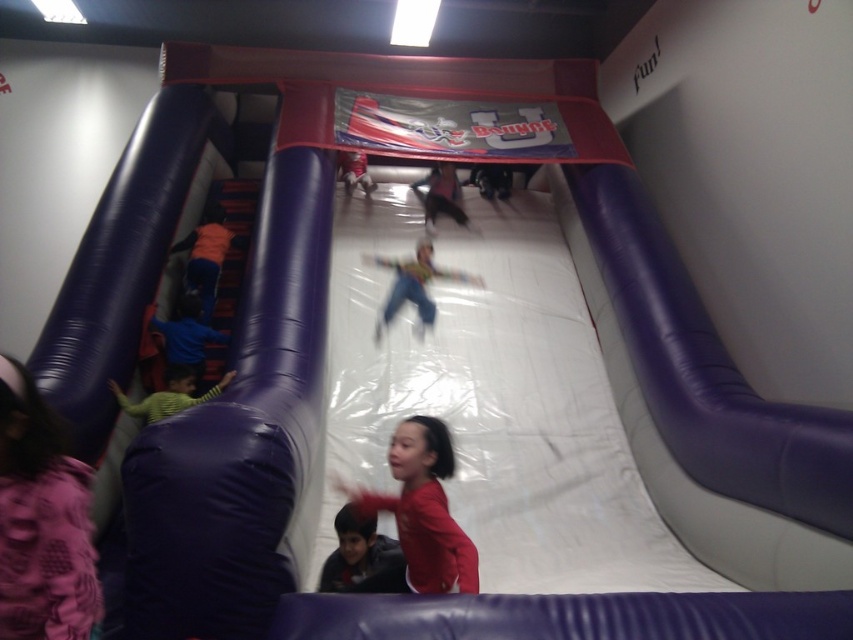
Does matte purple dress at lower left appear on the left side of orange fabric pants at left?

No, matte purple dress at lower left is not to the left of orange fabric pants at left.

Which of these two, matte purple dress at lower left or orange fabric pants at left, stands shorter?

matte purple dress at lower left

What do you see at coordinates (41, 522) in the screenshot? I see `matte purple dress at lower left` at bounding box center [41, 522].

The height and width of the screenshot is (640, 853). Find the location of `matte purple dress at lower left`. matte purple dress at lower left is located at coordinates (41, 522).

Can you confirm if matte red shirt at center is positioned above blue fabric child at left?

No, matte red shirt at center is not above blue fabric child at left.

Who is lower down, matte red shirt at center or blue fabric child at left?

matte red shirt at center

Between point (422, 579) and point (165, 324), which one is positioned behind?

The point (165, 324) is behind.

I want to click on matte red shirt at center, so click(422, 508).

The width and height of the screenshot is (853, 640). Find the location of `matte purple dress at lower left`. matte purple dress at lower left is located at coordinates (41, 522).

Consider the image. Is matte purple dress at lower left bigger than blue fabric child at left?

No, matte purple dress at lower left is not bigger than blue fabric child at left.

Who is more forward, (21,572) or (180,324)?

Positioned in front is point (21,572).

This screenshot has width=853, height=640. Find the location of `matte purple dress at lower left`. matte purple dress at lower left is located at coordinates (41, 522).